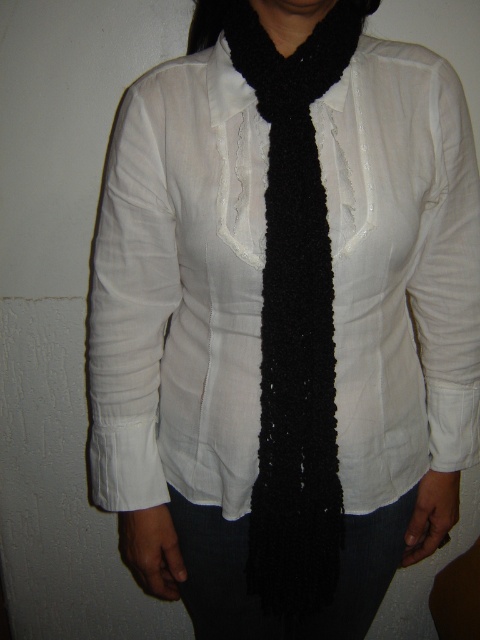
Question: Can you confirm if white cotton blouse at center is positioned to the left of black fuzzy scarf at center?

Choices:
 (A) yes
 (B) no

Answer: (A)

Question: Among these points, which one is nearest to the camera?

Choices:
 (A) (334, 88)
 (B) (308, 580)
 (C) (280, 22)

Answer: (A)

Question: Among these objects, which one is farthest from the camera?

Choices:
 (A) white cotton blouse at center
 (B) black knitted scarf at center

Answer: (A)

Question: Is white cotton blouse at center to the left of black fuzzy scarf at center from the viewer's perspective?

Choices:
 (A) no
 (B) yes

Answer: (B)

Question: Does white cotton blouse at center have a lesser width compared to black fuzzy scarf at center?

Choices:
 (A) no
 (B) yes

Answer: (A)

Question: Which point is closer to the camera taking this photo?

Choices:
 (A) (360, 301)
 (B) (271, 1)
 (C) (291, 580)

Answer: (B)